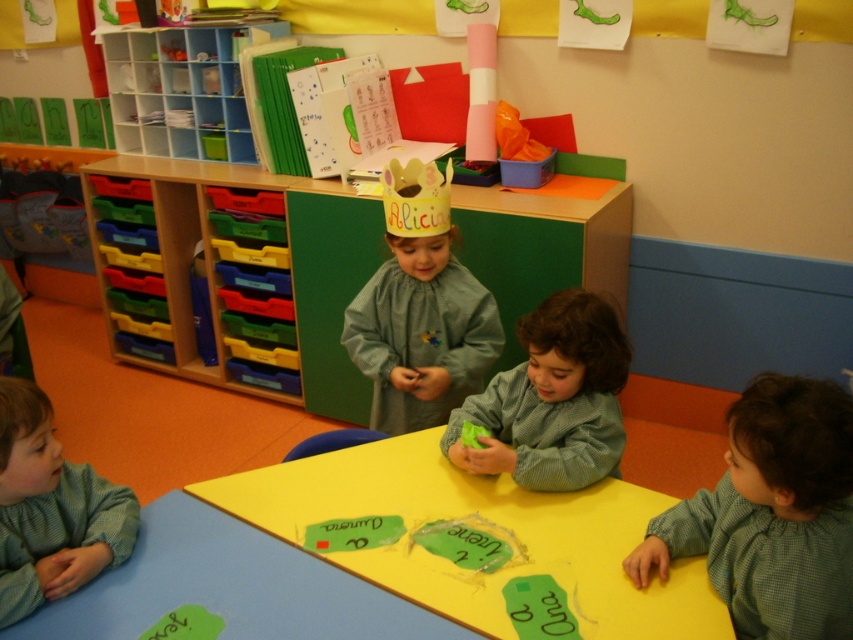
Describe the element at coordinates (772, 513) in the screenshot. The image size is (853, 640). I see `green checkered shirt at lower right` at that location.

Is green checkered shirt at lower right above matte gray dress at center?

Actually, green checkered shirt at lower right is below matte gray dress at center.

Image resolution: width=853 pixels, height=640 pixels. What are the coordinates of `green checkered shirt at lower right` in the screenshot? It's located at (772, 513).

Locate an element on the screen. green checkered shirt at lower right is located at coordinates (772, 513).

Which is below, green checkered shirt at lower right or green textured shirt at lower left?

green checkered shirt at lower right is below.

Does point (817, 621) lie behind point (62, 579)?

No, (817, 621) is closer to viewer.

Which is in front, point (808, 609) or point (126, 557)?

Point (808, 609)

The height and width of the screenshot is (640, 853). Find the location of `green checkered shirt at lower right`. green checkered shirt at lower right is located at coordinates (772, 513).

Is yellow matte table at center to the right of green knitted sweater at center from the viewer's perspective?

In fact, yellow matte table at center is to the left of green knitted sweater at center.

Can you confirm if yellow matte table at center is positioned above green knitted sweater at center?

Incorrect, yellow matte table at center is not positioned above green knitted sweater at center.

Which is behind, point (341, 486) or point (535, 333)?

The point (341, 486) is more distant.

The image size is (853, 640). I want to click on yellow matte table at center, so click(477, 541).